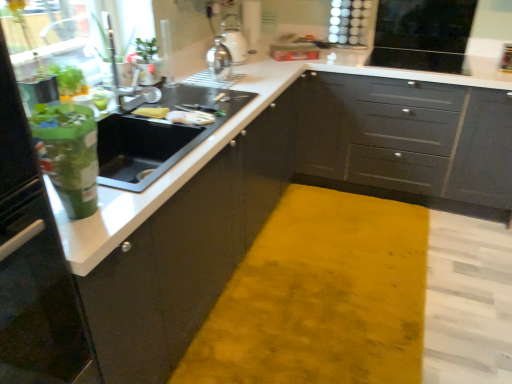
Question: Is matte black cabinets at center, arranged as the 2th cabinetry when viewed from the back, shorter than black glossy microwave at upper right, positioned as the first appliance in right-to-left order?

Choices:
 (A) yes
 (B) no

Answer: (B)

Question: From the image's perspective, does matte black cabinets at center, arranged as the 2th cabinetry when viewed from the back, appear higher than black glossy microwave at upper right, which is the first appliance in back-to-front order?

Choices:
 (A) yes
 (B) no

Answer: (B)

Question: From a real-world perspective, is matte black cabinets at center, which is the 1th cabinetry from front to back, physically below black glossy microwave at upper right, which is the first appliance in back-to-front order?

Choices:
 (A) no
 (B) yes

Answer: (B)

Question: Does matte black cabinets at center, arranged as the 2th cabinetry when viewed from the back, come behind black glossy microwave at upper right, the 3th appliance from the front?

Choices:
 (A) yes
 (B) no

Answer: (B)

Question: Is matte black cabinets at center, which is the 1th cabinetry from front to back, in front of black glossy microwave at upper right, which is the 3th appliance from left to right?

Choices:
 (A) no
 (B) yes

Answer: (B)

Question: In the image, is satin silver kettle at upper center, the 1th appliance when ordered from left to right, positioned in front of or behind matte gray cabinets at center, arranged as the 1th cabinetry when viewed from the back?

Choices:
 (A) front
 (B) behind

Answer: (A)

Question: Choose the correct answer: Is satin silver kettle at upper center, the 1th appliance when ordered from left to right, inside matte gray cabinets at center, which appears as the 2th cabinetry when viewed from the front, or outside it?

Choices:
 (A) inside
 (B) outside

Answer: (B)

Question: Is satin silver kettle at upper center, the 1th appliance when ordered from left to right, taller or shorter than matte gray cabinets at center, which appears as the 2th cabinetry when viewed from the front?

Choices:
 (A) tall
 (B) short

Answer: (B)

Question: From a real-world perspective, relative to matte gray cabinets at center, arranged as the 1th cabinetry when viewed from the back, is satin silver kettle at upper center, the 3th appliance when ordered from back to front, vertically above or below?

Choices:
 (A) below
 (B) above

Answer: (B)

Question: Which is correct: satin silver kettle at upper center, the 2th appliance from the back, is inside yellow sponge at sink, the second food positioned from the right, or outside of it?

Choices:
 (A) outside
 (B) inside

Answer: (A)

Question: From a real-world perspective, is satin silver kettle at upper center, placed as the 2th appliance when sorted from left to right, positioned above or below yellow sponge at sink, the second food positioned from the right?

Choices:
 (A) above
 (B) below

Answer: (A)

Question: Is satin silver kettle at upper center, placed as the 2th appliance when sorted from left to right, wider or thinner than yellow sponge at sink, the second food positioned from the right?

Choices:
 (A) thin
 (B) wide

Answer: (B)

Question: From the image's perspective, is satin silver kettle at upper center, the second appliance viewed from the right, located above or below yellow sponge at sink, the second food positioned from the right?

Choices:
 (A) below
 (B) above

Answer: (B)

Question: Is black glossy microwave at upper right, positioned as the first appliance in right-to-left order, inside the boundaries of matte gray cabinets at center, arranged as the 1th cabinetry when viewed from the back, or outside?

Choices:
 (A) outside
 (B) inside

Answer: (A)

Question: From a real-world perspective, is black glossy microwave at upper right, which is the 3th appliance from left to right, physically located above or below matte gray cabinets at center, arranged as the 1th cabinetry when viewed from the back?

Choices:
 (A) below
 (B) above

Answer: (B)